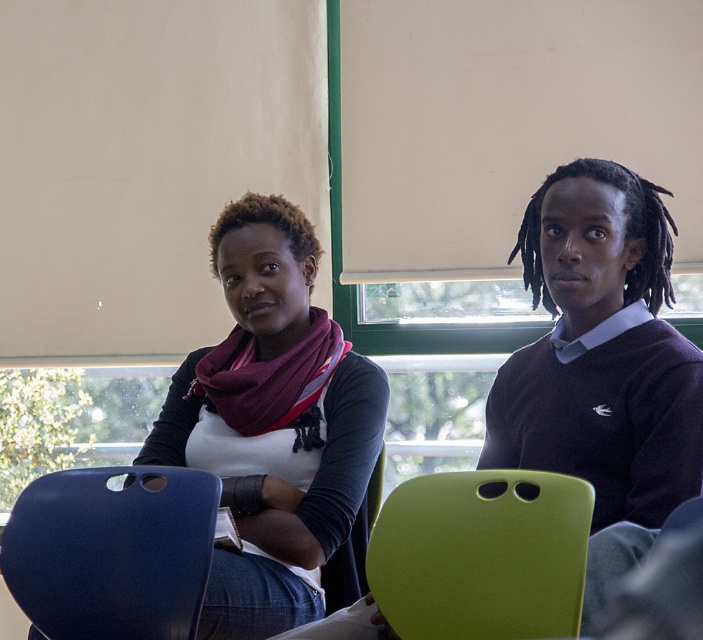
Question: Among these objects, which one is nearest to the camera?

Choices:
 (A) matte black sweater at center
 (B) matte blue chair at lower left

Answer: (B)

Question: Among these objects, which one is farthest from the camera?

Choices:
 (A) green matte chair at center
 (B) matte blue chair at lower left
 (C) matte black sweater at center

Answer: (C)

Question: Can you confirm if green matte chair at center is positioned to the left of matte blue chair at lower left?

Choices:
 (A) no
 (B) yes

Answer: (A)

Question: Which object appears closest to the camera in this image?

Choices:
 (A) green matte chair at center
 (B) matte blue chair at lower left
 (C) matte black sweater at center

Answer: (A)

Question: Is matte black sweater at center to the right of green matte chair at center from the viewer's perspective?

Choices:
 (A) no
 (B) yes

Answer: (A)

Question: Can you confirm if matte black sweater at center is thinner than green matte chair at center?

Choices:
 (A) yes
 (B) no

Answer: (B)